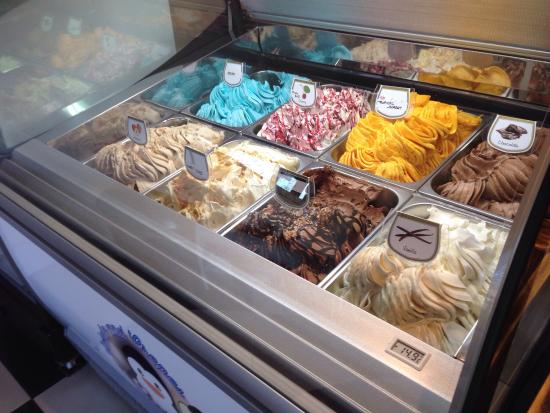
Identify the location of front of freezer. This screenshot has width=550, height=413. (164, 368).